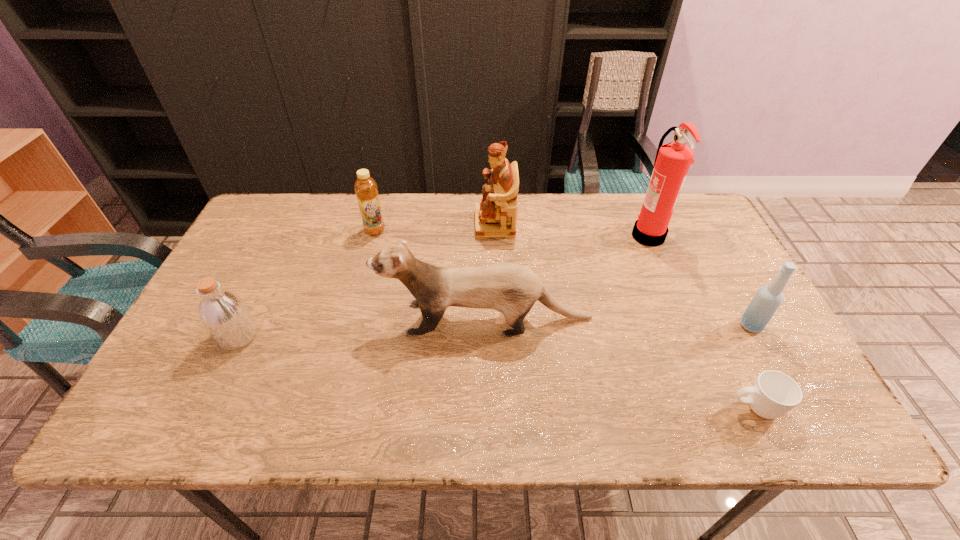
Locate an element on the screen. The image size is (960, 540). bottle situated at the right edge is located at coordinates (767, 300).

At what (x,y) coordinates should I click in order to perform the action: click on cup that is at the right edge. Please return your answer as a coordinate pair (x, y). This screenshot has width=960, height=540. Looking at the image, I should click on (773, 394).

What are the coordinates of `object at the far right corner` in the screenshot? It's located at (673, 160).

Where is `object that is at the near right corner`? This screenshot has height=540, width=960. object that is at the near right corner is located at coordinates (773, 394).

You are a GUI agent. You are given a task and a screenshot of the screen. Output one action in this format:
    pyautogui.click(x=<x>, y=<y>)
    Task: Click on the free location at the far edge of the desktop
    The width and height of the screenshot is (960, 540).
    Given the screenshot: What is the action you would take?
    pyautogui.click(x=593, y=226)

The height and width of the screenshot is (540, 960). In the image, there is a desktop. What are the coordinates of `vacant space at the near edge` in the screenshot? It's located at (539, 435).

You are a GUI agent. You are given a task and a screenshot of the screen. Output one action in this format:
    pyautogui.click(x=<x>, y=<y>)
    Task: Click on the vacant space at the left edge
    The image size is (960, 540).
    Given the screenshot: What is the action you would take?
    pyautogui.click(x=278, y=276)

Locate an element on the screen. This screenshot has height=540, width=960. vacant space at the right edge is located at coordinates (766, 360).

The image size is (960, 540). I want to click on vacant space at the far left corner, so click(x=284, y=237).

Locate an element on the screen. free point at the far right corner is located at coordinates (706, 215).